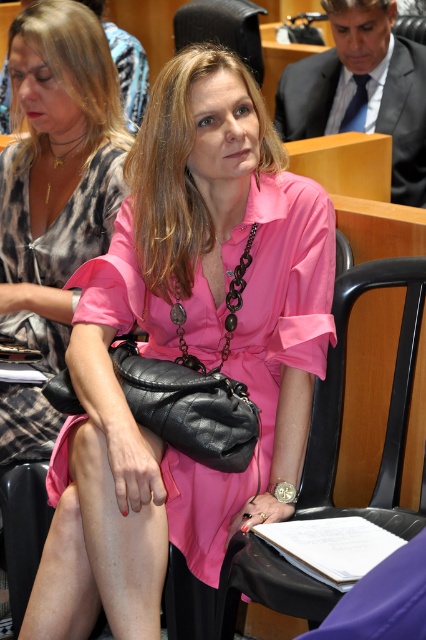
You are an assistant who needs to hand a document to the person holding the matte black purse at center and the black leather chair at center. Which object is closer to you so you can place the document there first?

The matte black purse at center is closer to you than the black leather chair at center, so you can place the document there first.

You are an assistant organizing items on a table. You need to place a matte black purse at center and a pink satin dress at center so that they align with the scene described. According to the scene, where should you position the matte black purse relative to the pink satin dress?

The matte black purse at center should be positioned to the right of the pink satin dress at center as per the scene description.

You are standing at point (253,97) and want to hand a document to the woman holding a black leather handbag. Can you reach her without moving from your current position?

The distance between you at point (253,97) and the woman holding a black leather handbag is 7.21 feet. Since the average human arm length is about 2.5 feet, you cannot reach her without moving closer.